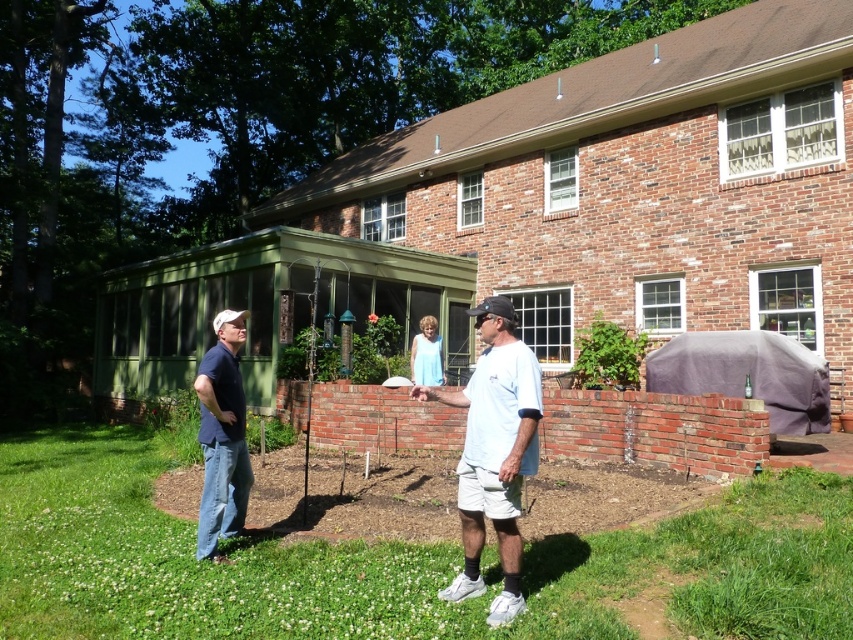
You are a photographer setting up a shot of the scene in front of the brick house. You want to ensure both the green grass at lower center and the dark blue shirt at left are visible in the frame. Given their sizes, which object should you focus on to make sure both are in the frame?

The green grass at lower center is larger than the dark blue shirt at left, so focusing on the green grass at lower center will ensure both are visible in the frame.

What is the 2D coordinate of the green grass at lower center in the image?

The green grass at lower center is located at the 2D coordinate point of (392, 563).

You are standing at the front of the brick house and want to walk towards the green grass at lower center. Which direction should you move relative to the dark blue shirt at left?

The green grass at lower center is located below the dark blue shirt at left, so you should move downward or towards the front of the scene to reach it.